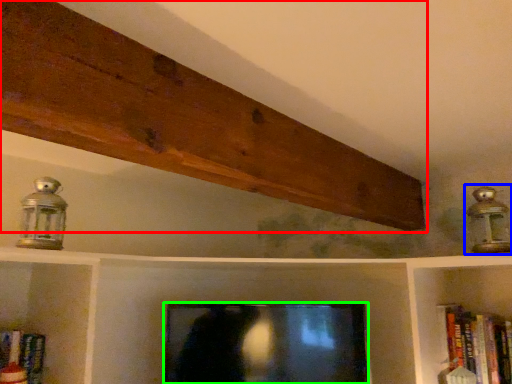
Question: Which object is positioned closest to plank (highlighted by a red box)? Select from lamp (highlighted by a blue box) and television (highlighted by a green box).

Choices:
 (A) lamp
 (B) television

Answer: (A)